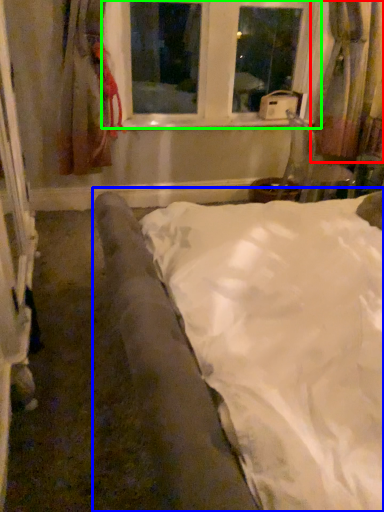
Question: Which is nearer to the curtain (highlighted by a red box)? bed (highlighted by a blue box) or window (highlighted by a green box).

Choices:
 (A) bed
 (B) window

Answer: (B)